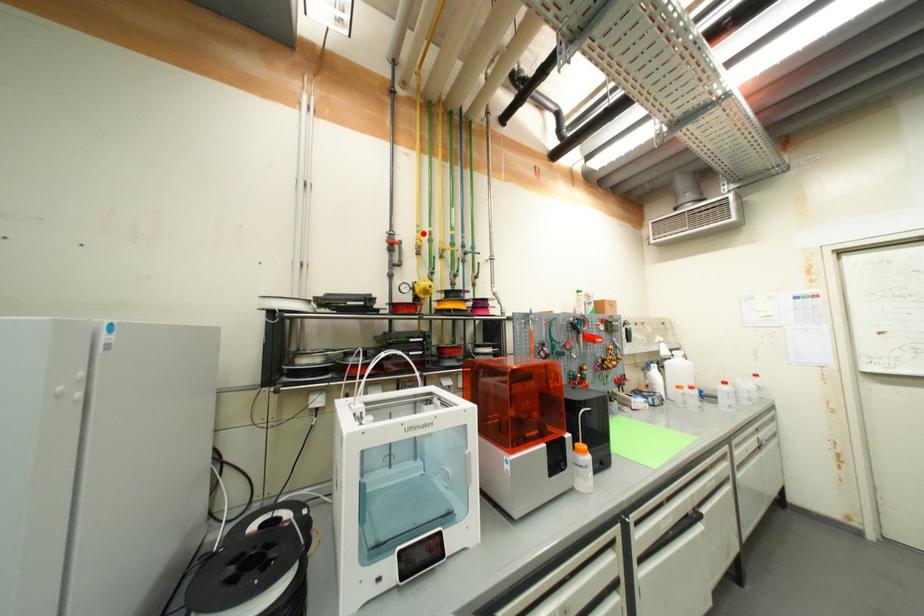
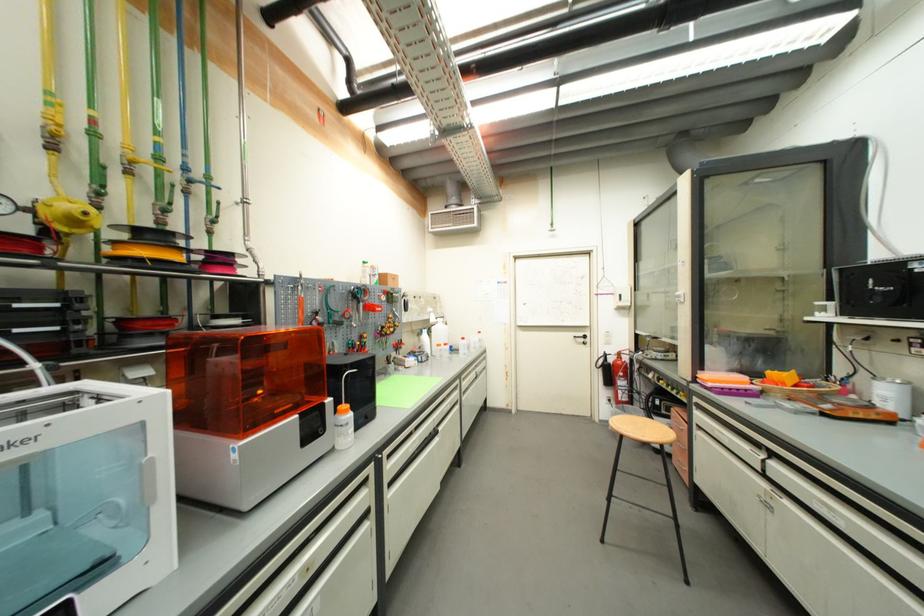
Find the pixel in the second image that matches the highlighted location in the first image.

(55, 106)